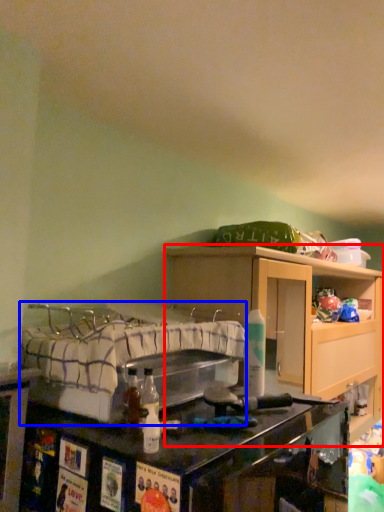
Question: Which point is further to the camera, cabinetry (highlighted by a red box) or bed (highlighted by a blue box)?

Choices:
 (A) cabinetry
 (B) bed

Answer: (A)